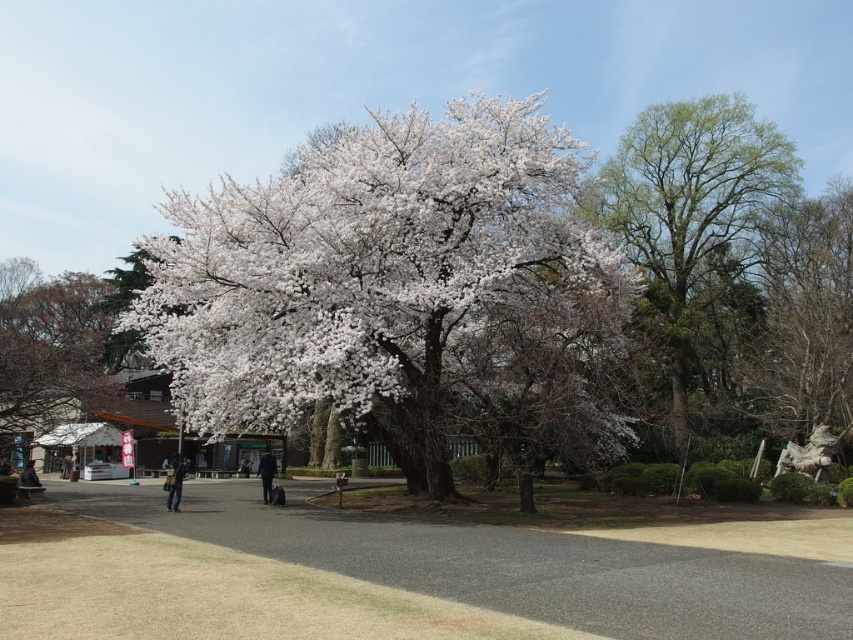
What do you see at coordinates (689, 202) in the screenshot? The image size is (853, 640). I see `green leafy tree at upper right` at bounding box center [689, 202].

Can you confirm if green leafy tree at upper right is taller than white blossoming tree at left?

Yes, green leafy tree at upper right is taller than white blossoming tree at left.

Where is `green leafy tree at upper right`? green leafy tree at upper right is located at coordinates (689, 202).

Does white matte flower at center appear under green leafy tree at upper right?

Actually, white matte flower at center is above green leafy tree at upper right.

Which is more to the left, white matte flower at center or green leafy tree at upper right?

From the viewer's perspective, white matte flower at center appears more on the left side.

Who is more forward, [438,282] or [693,108]?

Point [438,282] is in front.

This screenshot has width=853, height=640. I want to click on white matte flower at center, so click(x=364, y=266).

Is green leafy tree at upper right above bare brown branches at upper right?

Yes, green leafy tree at upper right is above bare brown branches at upper right.

Between green leafy tree at upper right and bare brown branches at upper right, which one is positioned higher?

green leafy tree at upper right

What do you see at coordinates (689, 202) in the screenshot? The height and width of the screenshot is (640, 853). I see `green leafy tree at upper right` at bounding box center [689, 202].

Find the location of `green leafy tree at upper right`. green leafy tree at upper right is located at coordinates (689, 202).